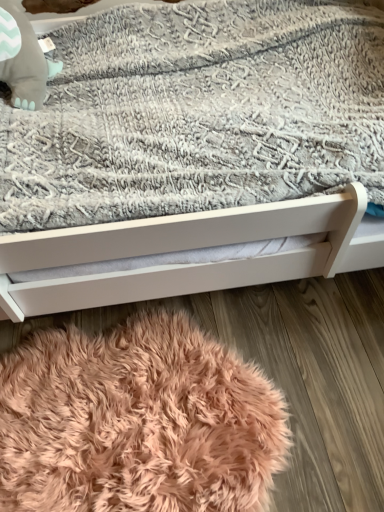
Question: Is matte gray plush baby elephant at upper left to the right of white matte bed at center from the viewer's perspective?

Choices:
 (A) yes
 (B) no

Answer: (B)

Question: From a real-world perspective, is matte gray plush baby elephant at upper left positioned over white matte bed at center based on gravity?

Choices:
 (A) no
 (B) yes

Answer: (B)

Question: Does matte gray plush baby elephant at upper left have a smaller size compared to white matte bed at center?

Choices:
 (A) yes
 (B) no

Answer: (A)

Question: Is matte gray plush baby elephant at upper left not near white matte bed at center?

Choices:
 (A) yes
 (B) no

Answer: (B)

Question: Does matte gray plush baby elephant at upper left have a lesser height compared to white matte bed at center?

Choices:
 (A) no
 (B) yes

Answer: (B)

Question: From the image's perspective, is matte gray plush baby elephant at upper left located beneath white matte bed at center?

Choices:
 (A) no
 (B) yes

Answer: (A)

Question: Is white matte bed at center shorter than peachy soft rug at lower center?

Choices:
 (A) yes
 (B) no

Answer: (B)

Question: From a real-world perspective, is white matte bed at center positioned over peachy soft rug at lower center based on gravity?

Choices:
 (A) yes
 (B) no

Answer: (A)

Question: Does white matte bed at center appear on the right side of peachy soft rug at lower center?

Choices:
 (A) no
 (B) yes

Answer: (B)

Question: Considering the relative positions of white matte bed at center and peachy soft rug at lower center in the image provided, is white matte bed at center to the left of peachy soft rug at lower center from the viewer's perspective?

Choices:
 (A) no
 (B) yes

Answer: (A)

Question: Can you confirm if white matte bed at center is smaller than peachy soft rug at lower center?

Choices:
 (A) no
 (B) yes

Answer: (A)

Question: Does white matte bed at center have a lesser width compared to peachy soft rug at lower center?

Choices:
 (A) yes
 (B) no

Answer: (B)

Question: From a real-world perspective, is white matte bed at center physically below matte gray plush baby elephant at upper left?

Choices:
 (A) yes
 (B) no

Answer: (A)